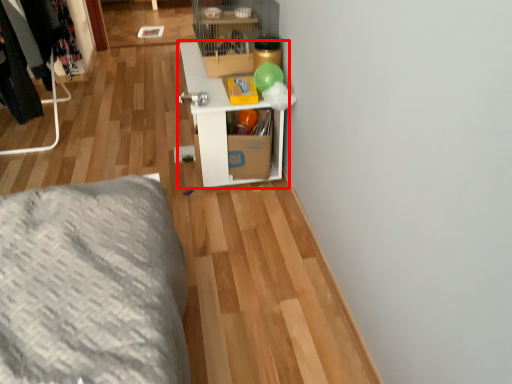
Question: From the image's perspective, considering the relative positions of shelf (annotated by the red box) and furniture in the image provided, where is shelf (annotated by the red box) located with respect to the staircase?

Choices:
 (A) above
 (B) below

Answer: (B)